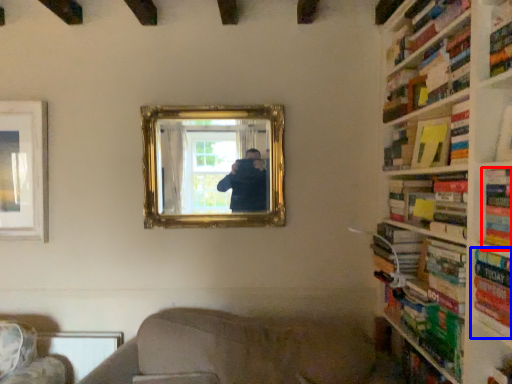
Question: Which object is closer to the camera taking this photo, book (highlighted by a red box) or book (highlighted by a blue box)?

Choices:
 (A) book
 (B) book

Answer: (B)